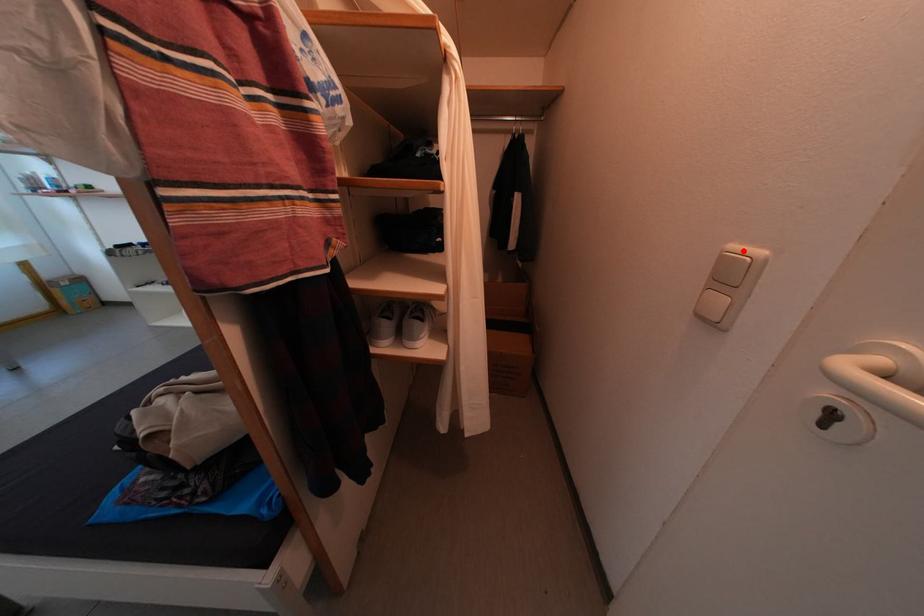
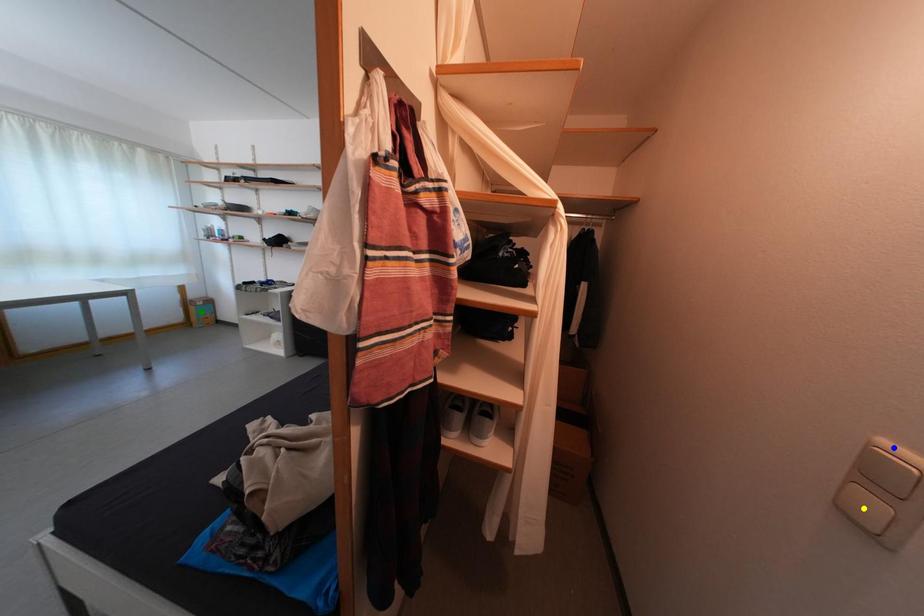
Question: I am providing you with two images of the same scene from different viewpoints. A red point is marked on the first image. You are given multiple points on the second image. Can you choose the point in image 2 that corresponds to the point in image 1?

Choices:
 (A) yellow point
 (B) blue point
 (C) green point

Answer: (B)